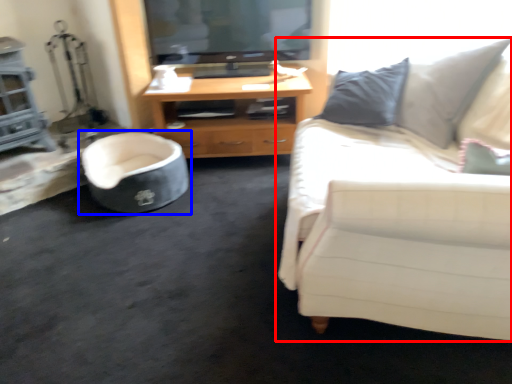
Question: Which point is further to the camera, studio couch (highlighted by a red box) or chair (highlighted by a blue box)?

Choices:
 (A) studio couch
 (B) chair

Answer: (B)